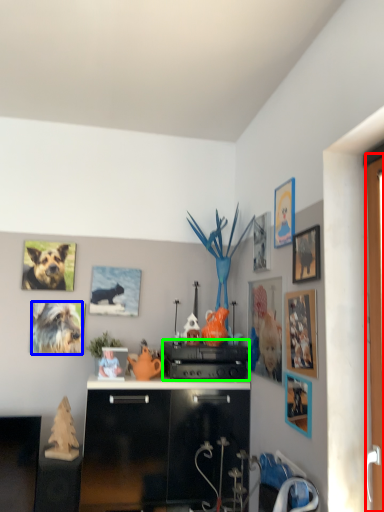
Question: Which object is the closest to the screen door (highlighted by a red box)? Choose among these: dog (highlighted by a blue box) or appliance (highlighted by a green box).

Choices:
 (A) dog
 (B) appliance

Answer: (B)